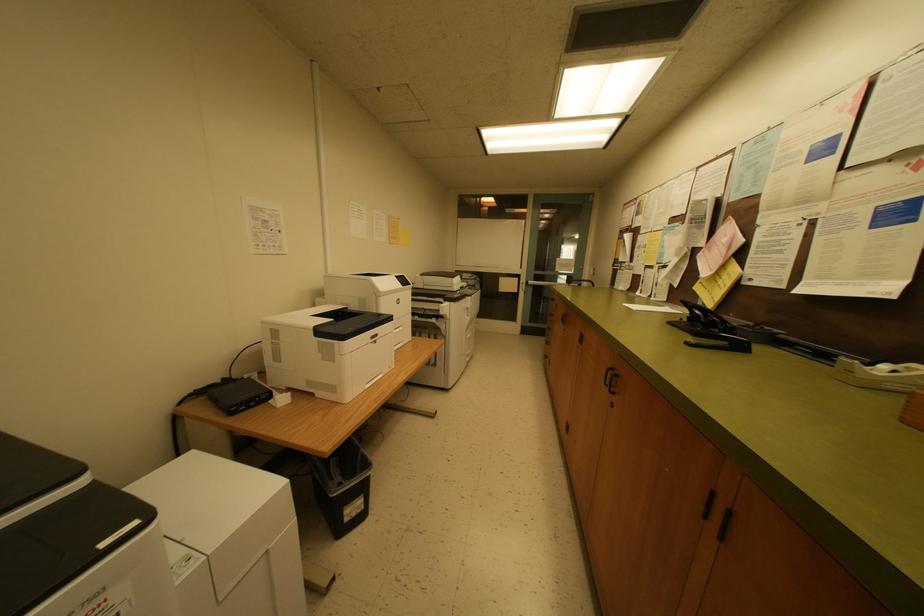
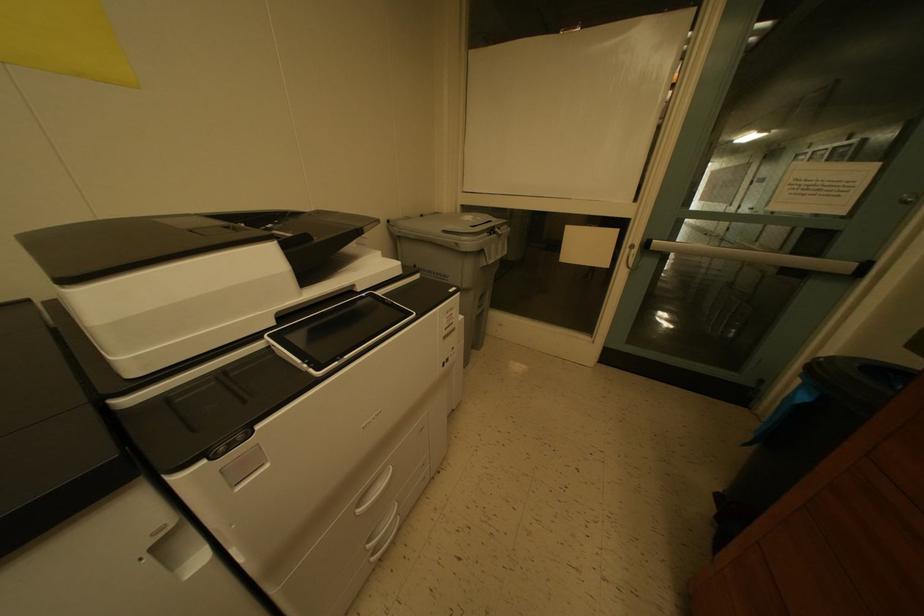
Question: What movement of the cameraman would produce the second image?

Choices:
 (A) Left
 (B) Right
 (C) Forward
 (D) Backward

Answer: (C)